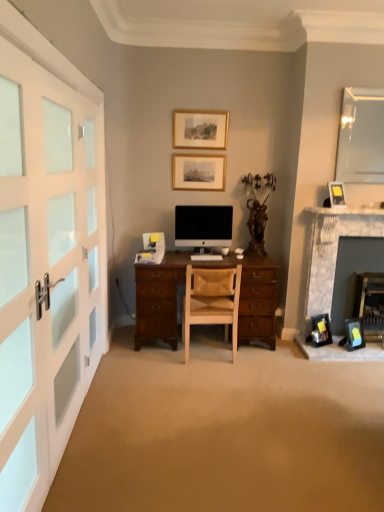
Where is `vacant space underneath gold-framed picture at upper center, which is counted as the fifth picture frame, starting from the bottom (from a real-world perspective)`? This screenshot has height=512, width=384. vacant space underneath gold-framed picture at upper center, which is counted as the fifth picture frame, starting from the bottom (from a real-world perspective) is located at coordinates (208, 148).